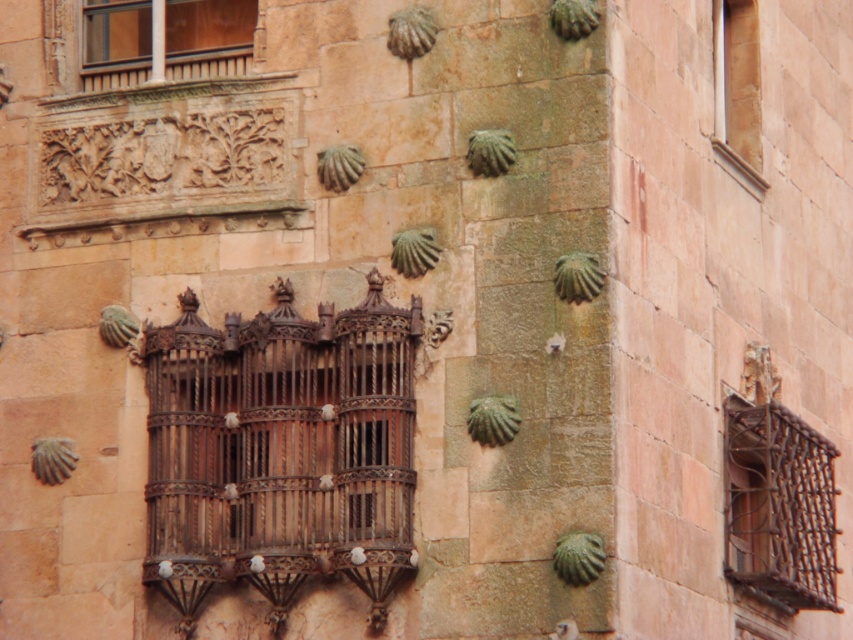
You are standing in front of the building and want to look up to see the rusty metal balcony at right. Will it be directly below the matte glass window at upper left?

The rusty metal balcony at right is positioned under matte glass window at upper left, so yes, it is directly below the matte glass window at upper left.

You are an architect assessing the building facade. You need to determine which object occupies a larger area on the wall between the rusty metal balcony at right and the matte brown wood at upper right. Which one is it?

The matte brown wood at upper right occupies a larger area on the wall compared to the rusty metal balcony at right, as the rusty metal balcony at right has a smaller size compared to matte brown wood at upper right.